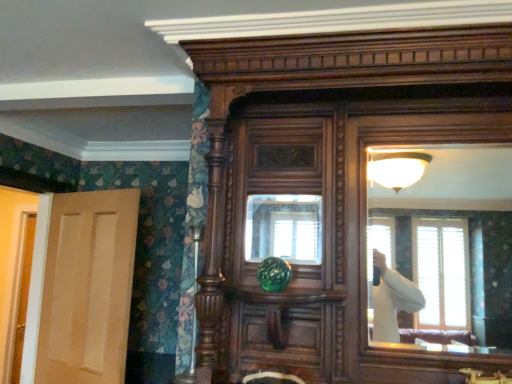
Image resolution: width=512 pixels, height=384 pixels. What do you see at coordinates (87, 288) in the screenshot? I see `beige matte door at left` at bounding box center [87, 288].

Identify the location of beige matte door at left. The height and width of the screenshot is (384, 512). (87, 288).

Identify the location of beige matte door at left. (87, 288).